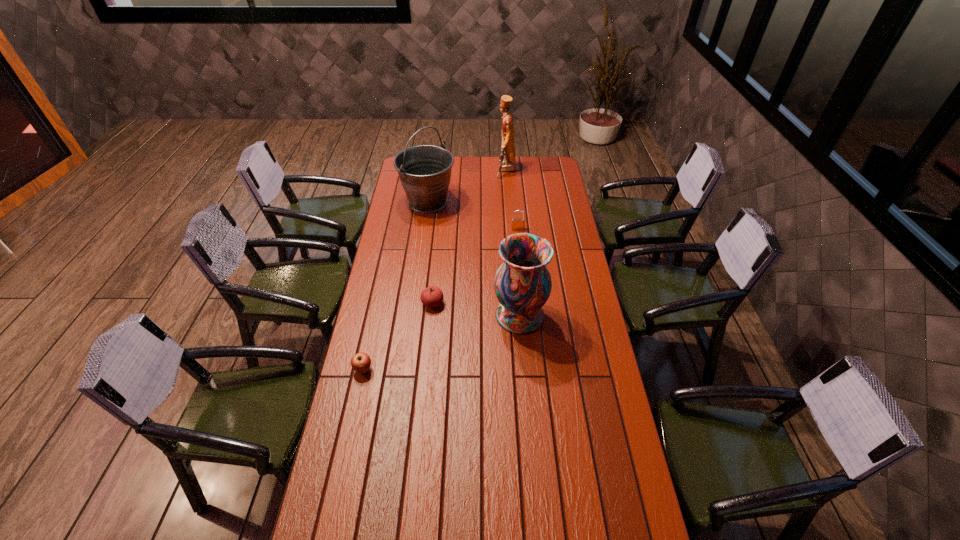
This screenshot has width=960, height=540. In the image, there is a desktop. Find the location of `vacant space at the right edge`. vacant space at the right edge is located at coordinates (566, 210).

This screenshot has height=540, width=960. Identify the location of blank region between the third tallest object and the tomato. (476, 309).

This screenshot has height=540, width=960. Identify the location of free spot between the farthest object and the apple. (435, 270).

This screenshot has width=960, height=540. Identify the location of free spot between the third tallest object and the fifth nearest object. (474, 259).

At what (x,y) coordinates should I click in order to perform the action: click on free spot between the bucket and the nearest object. Please return your answer as a coordinate pair (x, y). This screenshot has height=540, width=960. Looking at the image, I should click on (396, 286).

What are the coordinates of `vacant point located between the tomato and the fifth nearest object` in the screenshot? It's located at (430, 252).

This screenshot has width=960, height=540. Find the location of `vacant space that is in between the second farthest object and the third tallest object`. vacant space that is in between the second farthest object and the third tallest object is located at coordinates (474, 259).

The image size is (960, 540). I want to click on free space that is in between the tomato and the second farthest object, so click(430, 252).

Identify the location of free point between the tomato and the third tallest object. (476, 309).

Identify the location of free space between the apple and the vase. The width and height of the screenshot is (960, 540). (442, 342).